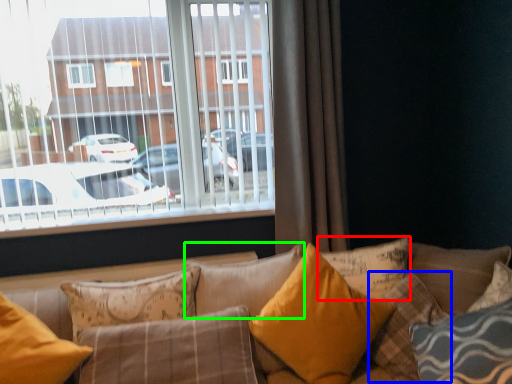
Question: Estimate the real-world distances between objects in this image. Which object is closer to pillow (highlighted by a red box), pillow (highlighted by a blue box) or pillow (highlighted by a green box)?

Choices:
 (A) pillow
 (B) pillow

Answer: (A)